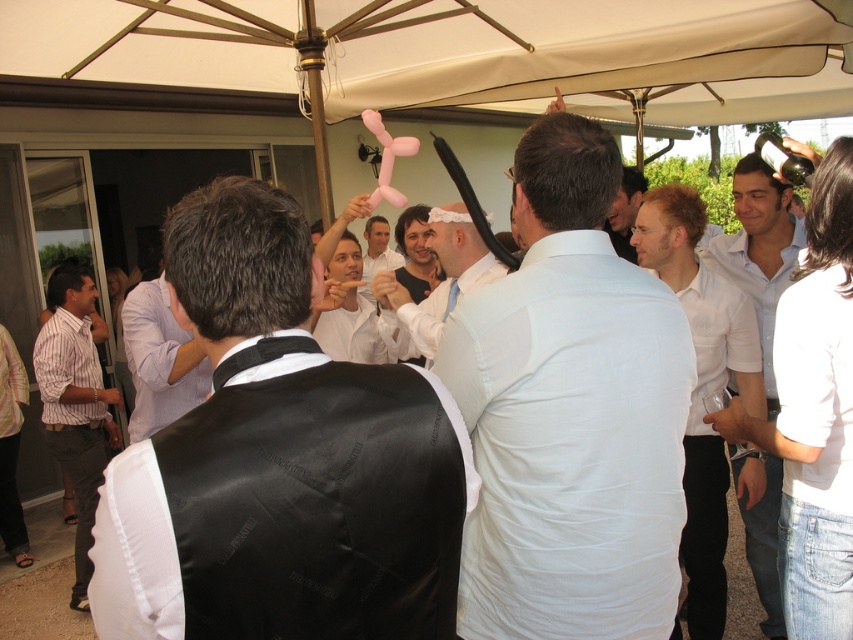
Can you confirm if black satin vest at center is positioned to the left of striped shirt at left?

In fact, black satin vest at center is to the right of striped shirt at left.

Is black satin vest at center shorter than striped shirt at left?

Indeed, black satin vest at center has a lesser height compared to striped shirt at left.

Does point (358, 368) come in front of point (85, 480)?

Yes, point (358, 368) is in front of point (85, 480).

Find the location of a particular element. The height and width of the screenshot is (640, 853). black satin vest at center is located at coordinates (279, 461).

Is white smooth shirt at center positioned at the back of white lace headband at center?

No, it is in front of white lace headband at center.

Does point (577, 506) lie behind point (439, 225)?

No, (577, 506) is in front of (439, 225).

You are a GUI agent. You are given a task and a screenshot of the screen. Output one action in this format:
    pyautogui.click(x=<x>, y=<y>)
    Task: Click on the white smooth shirt at center
    The width and height of the screenshot is (853, 640).
    Given the screenshot: What is the action you would take?
    pyautogui.click(x=570, y=413)

Does light brown hair at center have a lesser width compared to striped shirt at left?

Yes.

Which is above, light brown hair at center or striped shirt at left?

light brown hair at center

Based on the photo, who is more distant from viewer, [752,324] or [49,408]?

The point [49,408] is more distant.

Find the location of `light brown hair at center`. light brown hair at center is located at coordinates (701, 385).